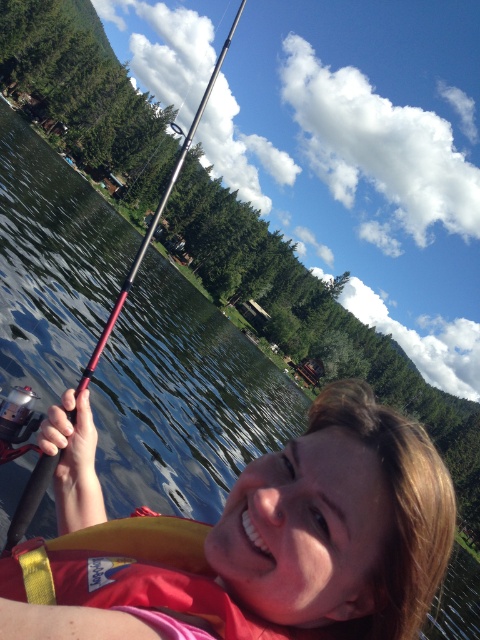
Question: Is matte yellow life vest at lower center further to the viewer compared to yellow fabric life jacket at lower center?

Choices:
 (A) yes
 (B) no

Answer: (B)

Question: Is matte yellow life vest at lower center to the left of metallic fishing pole at upper left from the viewer's perspective?

Choices:
 (A) no
 (B) yes

Answer: (A)

Question: Which point appears farthest from the camera in this image?

Choices:
 (A) (336, 412)
 (B) (175, 168)
 (C) (93, 552)

Answer: (B)

Question: Considering the real-world distances, which object is closest to the yellow fabric life jacket at lower center?

Choices:
 (A) metallic fishing pole at upper left
 (B) matte yellow life vest at lower center

Answer: (B)

Question: Is yellow fabric life jacket at lower center further to the viewer compared to metallic fishing pole at upper left?

Choices:
 (A) yes
 (B) no

Answer: (B)

Question: Which of the following is the closest to the observer?

Choices:
 (A) (129, 573)
 (B) (87, 381)
 (C) (361, 392)

Answer: (A)